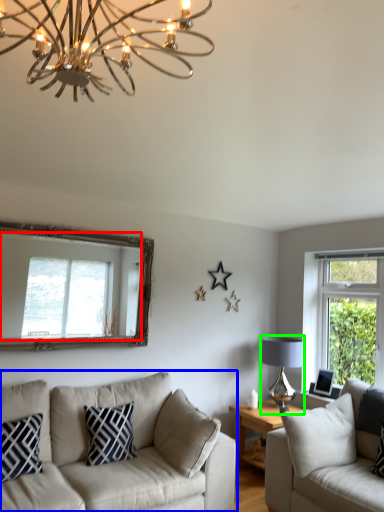
Question: Estimate the real-world distances between objects in this image. Which object is farther from window (highlighted by a red box), studio couch (highlighted by a blue box) or lamp (highlighted by a green box)?

Choices:
 (A) studio couch
 (B) lamp

Answer: (B)